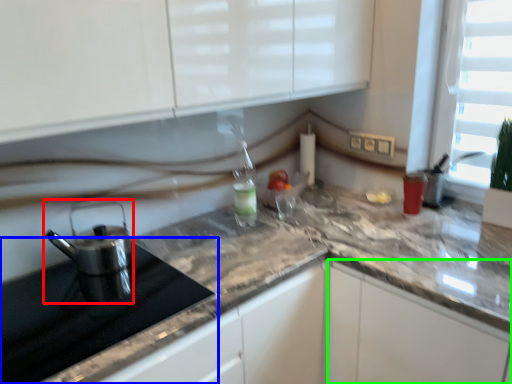
Question: Which object is positioned closest to kitchen appliance (highlighted by a red box)? Select from appliance (highlighted by a blue box) and cabinetry (highlighted by a green box).

Choices:
 (A) appliance
 (B) cabinetry

Answer: (A)